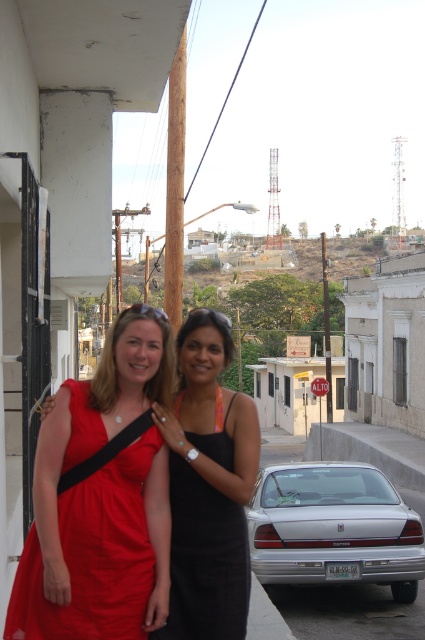
Which is in front, point (175, 456) or point (314, 464)?

Point (175, 456) is more forward.

Is matte red dress at center positioned in front of silver metallic sedan at lower center?

Yes, it is in front of silver metallic sedan at lower center.

You are a GUI agent. You are given a task and a screenshot of the screen. Output one action in this format:
    pyautogui.click(x=<x>, y=<y>)
    Task: Click on the matte red dress at center
    
    Given the screenshot: What is the action you would take?
    pyautogui.click(x=207, y=484)

Is matte red dress at left above silver metallic sedan at lower center?

Indeed, matte red dress at left is positioned over silver metallic sedan at lower center.

Between point (144, 566) and point (393, 522), which one is positioned in front?

Point (144, 566) is more forward.

The width and height of the screenshot is (425, 640). What are the coordinates of `matte red dress at left` in the screenshot? It's located at (93, 557).

This screenshot has width=425, height=640. In order to click on matte red dress at left in this screenshot , I will do `click(93, 557)`.

Between silver metallic sedan at lower center and black satin dress at center, which one is positioned lower?

silver metallic sedan at lower center is below.

Consider the image. Who is more distant from viewer, (422, 570) or (227, 548)?

The point (422, 570) is behind.

Where is `silver metallic sedan at lower center`? The width and height of the screenshot is (425, 640). silver metallic sedan at lower center is located at coordinates (334, 529).